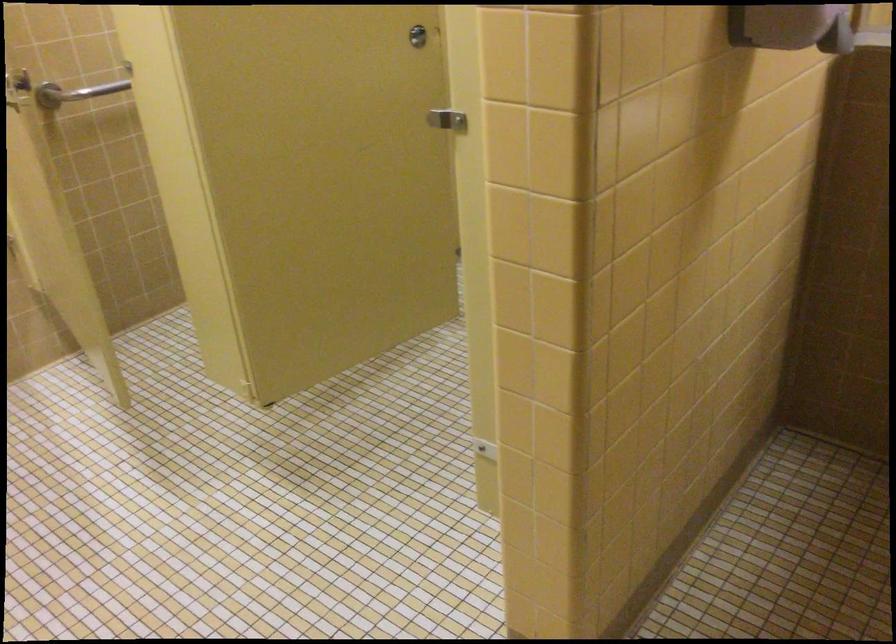
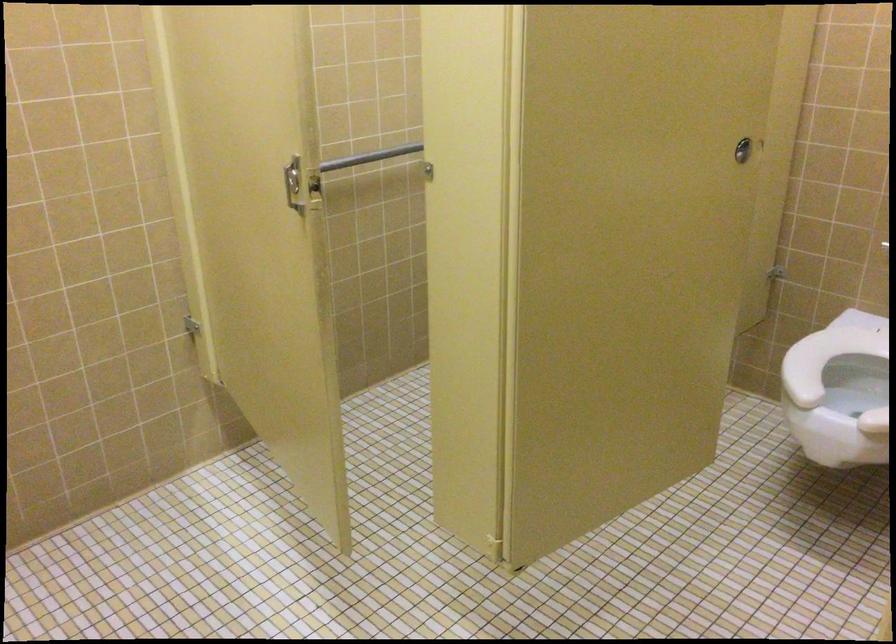
The images are taken continuously from a first-person perspective. In which direction are you moving?

The cameraman walked toward left, forward.